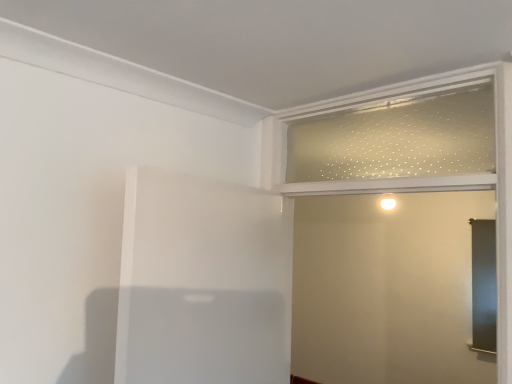
Question: In terms of width, does clear glass window frame at upper right look wider or thinner when compared to clear frosted glass screen door at upper right?

Choices:
 (A) thin
 (B) wide

Answer: (A)

Question: Considering the positions of clear glass window frame at upper right and clear frosted glass screen door at upper right in the image, is clear glass window frame at upper right bigger or smaller than clear frosted glass screen door at upper right?

Choices:
 (A) small
 (B) big

Answer: (A)

Question: Which is farther from the clear glass window frame at upper right?

Choices:
 (A) white matte elevator at center
 (B) clear frosted glass screen door at upper right

Answer: (B)

Question: Which object is the farthest from the clear glass window frame at upper right?

Choices:
 (A) clear frosted glass screen door at upper right
 (B) white matte elevator at center

Answer: (A)